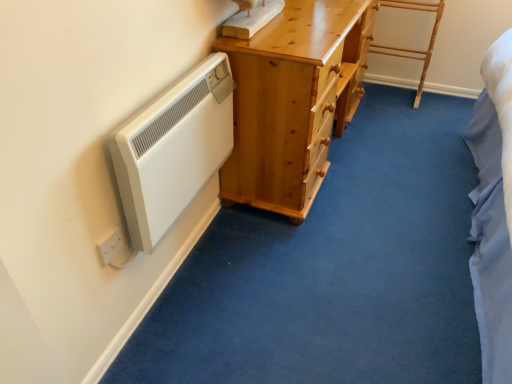
Locate an element on the screen. This screenshot has height=384, width=512. free space between light brown wooden chest of drawers at center and light wood/rough textured ladder at upper right is located at coordinates (369, 135).